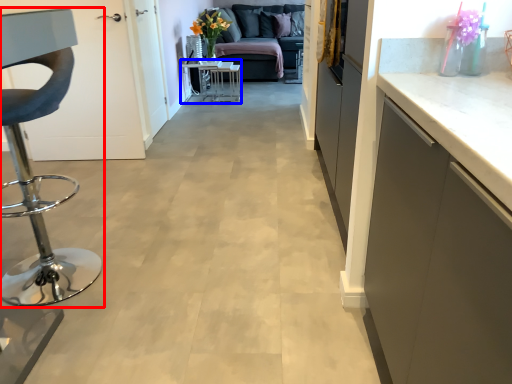
Question: Which of the following is the closest to the observer, furniture (highlighted by a red box) or table (highlighted by a blue box)?

Choices:
 (A) furniture
 (B) table

Answer: (A)